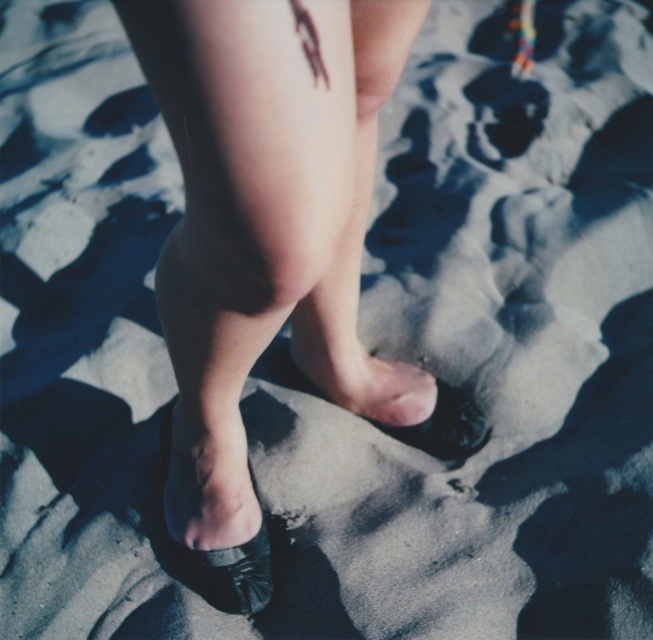
Is smooth skin leg at center bigger than shiny black shoe at lower center?

Yes.

Image resolution: width=653 pixels, height=640 pixels. I want to click on smooth skin leg at center, so click(358, 272).

You are a GUI agent. You are given a task and a screenshot of the screen. Output one action in this format:
    pyautogui.click(x=<x>, y=<y>)
    Task: Click on the smooth skin leg at center
    The image size is (653, 640).
    Given the screenshot: What is the action you would take?
    pyautogui.click(x=358, y=272)

Can you confirm if matte black shoe at center is positioned below smooth skin leg at center?

Yes, matte black shoe at center is below smooth skin leg at center.

Does matte black shoe at center have a lesser height compared to smooth skin leg at center?

In fact, matte black shoe at center may be taller than smooth skin leg at center.

You are a GUI agent. You are given a task and a screenshot of the screen. Output one action in this format:
    pyautogui.click(x=<x>, y=<y>)
    Task: Click on the matte black shoe at center
    
    Given the screenshot: What is the action you would take?
    pyautogui.click(x=242, y=240)

Locate an element on the screen. The width and height of the screenshot is (653, 640). matte black shoe at center is located at coordinates (242, 240).

Can you confirm if smooth skin leg at center is wider than black matte sandal at center?

Yes.

Is smooth skin leg at center further to the viewer compared to black matte sandal at center?

No.

Between point (358, 385) and point (438, 390), which one is positioned behind?

Positioned behind is point (438, 390).

You are a GUI agent. You are given a task and a screenshot of the screen. Output one action in this format:
    pyautogui.click(x=<x>, y=<y>)
    Task: Click on the smooth skin leg at center
    
    Given the screenshot: What is the action you would take?
    click(x=358, y=272)